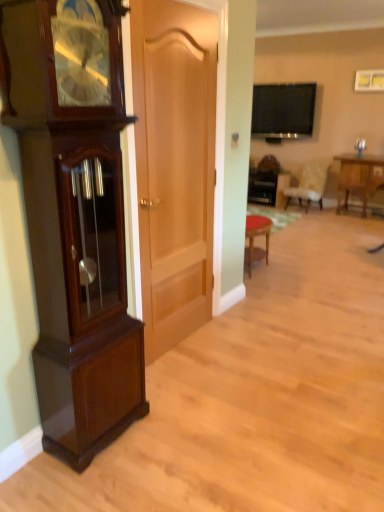
Question: Is wooden table at center, the 2th table positioned from the right, to the left or to the right of flat-screen tv at upper center in the image?

Choices:
 (A) right
 (B) left

Answer: (B)

Question: Looking at their shapes, would you say wooden table at center, the 2th table positioned from the right, is wider or thinner than flat-screen tv at upper center?

Choices:
 (A) wide
 (B) thin

Answer: (A)

Question: Which object is positioned farthest from the flat-screen tv at upper center?

Choices:
 (A) light beige fabric chair at center
 (B) mahogany wood grandfather clock at left
 (C) wooden table at center, which appears as the second table when viewed from the front
 (D) wooden table at right, which is the second table in left-to-right order
 (E) light brown wood door at center

Answer: (B)

Question: Estimate the real-world distances between objects in this image. Which object is closer to the light beige fabric chair at center?

Choices:
 (A) light brown wood door at center
 (B) mahogany wood grandfather clock at left
 (C) wooden table at center, positioned as the first table in left-to-right order
 (D) wooden table at right, the first table viewed from the right
 (E) flat-screen tv at upper center

Answer: (C)